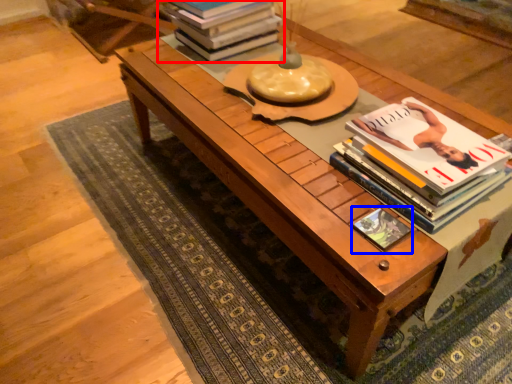
Question: Among these objects, which one is farthest to the camera, book (highlighted by a red box) or book cover (highlighted by a blue box)?

Choices:
 (A) book
 (B) book cover

Answer: (A)